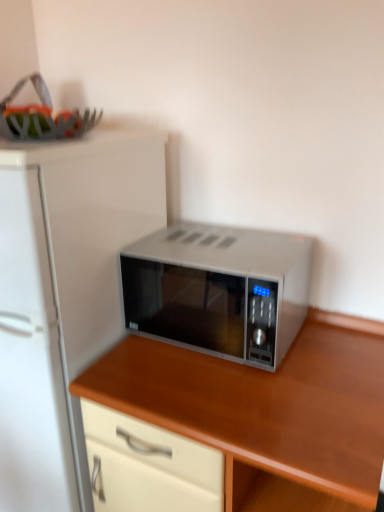
This screenshot has height=512, width=384. Describe the element at coordinates (265, 406) in the screenshot. I see `satin silver microwave at center` at that location.

In order to face white matte refrigerator at left, should I rotate leftwards or rightwards?

To face it directly, rotate left by 16.371 degrees.

The height and width of the screenshot is (512, 384). I want to click on satin silver microwave at center, so click(265, 406).

From a real-world perspective, is satin silver microwave at center located higher than white matte refrigerator at left?

Correct, in the physical world, satin silver microwave at center is higher than white matte refrigerator at left.

Where is `microwave oven that appears above the white matte refrigerator at left (from the image's perspective)`? The height and width of the screenshot is (512, 384). microwave oven that appears above the white matte refrigerator at left (from the image's perspective) is located at coordinates (218, 290).

Is satin silver microwave at center positioned with its back to white matte refrigerator at left?

No, satin silver microwave at center is not facing the opposite direction of white matte refrigerator at left.

In terms of size, does satin silver microwave at center appear bigger or smaller than white matte refrigerator at left?

Considering their sizes, satin silver microwave at center takes up less space than white matte refrigerator at left.

Where is `refrigerator that appears below the satin silver microwave at center (from a real-world perspective)`? refrigerator that appears below the satin silver microwave at center (from a real-world perspective) is located at coordinates (64, 294).

Does white matte refrigerator at left have a smaller size compared to satin silver microwave at center?

Incorrect, white matte refrigerator at left is not smaller in size than satin silver microwave at center.

From a real-world perspective, relative to satin silver microwave at center, is white matte refrigerator at left vertically above or below?

white matte refrigerator at left is below satin silver microwave at center.

Which is behind, white matte refrigerator at left or satin silver microwave at center?

satin silver microwave at center is more distant.

Can you confirm if white matte refrigerator at left is thinner than satin silver microwave at center?

Incorrect, the width of white matte refrigerator at left is not less than that of satin silver microwave at center.

Is satin silver microwave at center at the back of white matte refrigerator at left?

white matte refrigerator at left does not have its back to satin silver microwave at center.

Is white matte refrigerator at left not close to satin silver microwave at center?

white matte refrigerator at left is near satin silver microwave at center, not far away.

Which is behind, point (307, 412) or point (29, 155)?

The point (307, 412) is behind.

From a real-world perspective, which is physically below, satin silver microwave at center or white matte refrigerator at left?

In real-world perspective, satin silver microwave at center is lower.

Can you confirm if satin silver microwave at center is shorter than white matte refrigerator at left?

Yes.

Looking at this image, do you think satin silver microwave at center is within white matte refrigerator at left, or outside of it?

satin silver microwave at center is not enclosed by white matte refrigerator at left.

From the image's perspective, is satin silver microwave at center below satin silver microwave at center?

No.

Is satin silver microwave at center facing away from satin silver microwave at center?

No, satin silver microwave at center is not facing the opposite direction of satin silver microwave at center.

From a real-world perspective, which is physically below, satin silver microwave at center or satin silver microwave at center?

satin silver microwave at center, from a real-world perspective.

Which is more to the left, satin silver microwave at center or satin silver microwave at center?

satin silver microwave at center is more to the left.

Is satin silver microwave at center positioned before satin silver microwave at center?

Yes, the depth of satin silver microwave at center is less than that of satin silver microwave at center.

This screenshot has height=512, width=384. I want to click on microwave oven behind the satin silver microwave at center, so click(x=218, y=290).

Is satin silver microwave at center surrounded by satin silver microwave at center?

No, satin silver microwave at center does not contain satin silver microwave at center.

Could you tell me if satin silver microwave at center is facing satin silver microwave at center?

No, satin silver microwave at center is not oriented towards satin silver microwave at center.

The image size is (384, 512). What are the coordinates of `microwave oven behind the white matte refrigerator at left` in the screenshot? It's located at [218, 290].

Where is `microwave oven above the white matte refrigerator at left (from a real-world perspective)`? microwave oven above the white matte refrigerator at left (from a real-world perspective) is located at coordinates click(x=218, y=290).

Which object lies further to the anchor point white matte refrigerator at left, satin silver microwave at center or satin silver microwave at center?

satin silver microwave at center.

From the image, which object appears to be nearer to satin silver microwave at center, white matte refrigerator at left or satin silver microwave at center?

satin silver microwave at center.

Considering their positions, is white matte refrigerator at left positioned closer to satin silver microwave at center than satin silver microwave at center?

satin silver microwave at center is closer to satin silver microwave at center.

From the image, which object appears to be farther from white matte refrigerator at left, satin silver microwave at center or satin silver microwave at center?

Based on the image, satin silver microwave at center appears to be further to white matte refrigerator at left.

Considering their positions, is satin silver microwave at center positioned closer to satin silver microwave at center than white matte refrigerator at left?

satin silver microwave at center lies closer to satin silver microwave at center than the other object.

Which object lies further to the anchor point satin silver microwave at center, satin silver microwave at center or white matte refrigerator at left?

white matte refrigerator at left is further to satin silver microwave at center.

You are a GUI agent. You are given a task and a screenshot of the screen. Output one action in this format:
    pyautogui.click(x=<x>, y=<y>)
    Task: Click on the microwave oven between white matte refrigerator at left and satin silver microwave at center in the horizontal direction
    Image resolution: width=384 pixels, height=512 pixels.
    Given the screenshot: What is the action you would take?
    pyautogui.click(x=218, y=290)